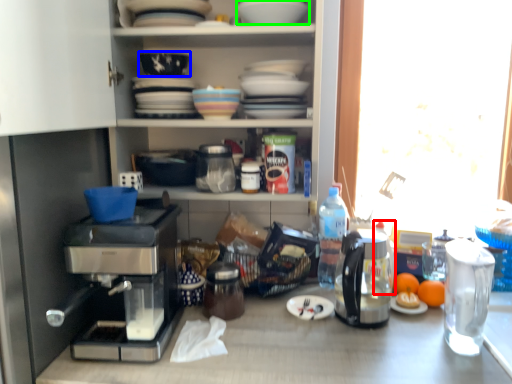
Question: Considering the real-world distances, which object is farthest from bottle (highlighted by a red box)? bowl (highlighted by a blue box) or tableware (highlighted by a green box)?

Choices:
 (A) bowl
 (B) tableware

Answer: (A)